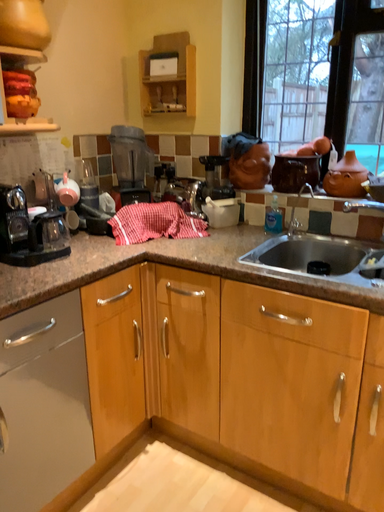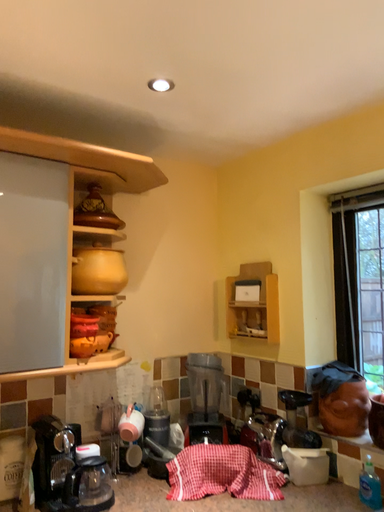
Question: How did the camera likely rotate when shooting the video?

Choices:
 (A) rotated left
 (B) rotated right

Answer: (A)